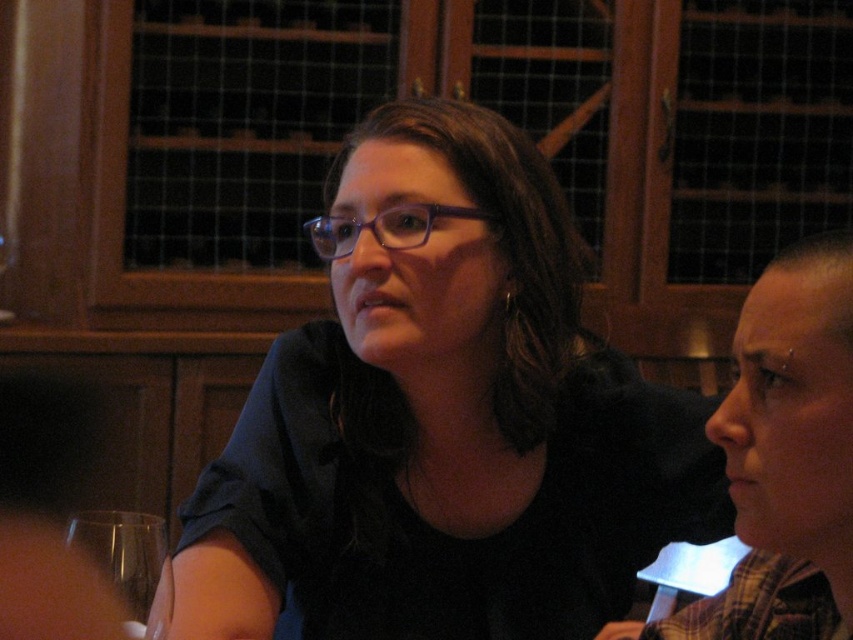
Question: Does matte black shirt at center lie in front of transparent glass at lower left?

Choices:
 (A) yes
 (B) no

Answer: (B)

Question: Which of the following is the farthest from the observer?

Choices:
 (A) matte black shirt at center
 (B) transparent glass at lower left

Answer: (A)

Question: Is matte black shirt at center below transparent glass at lower left?

Choices:
 (A) no
 (B) yes

Answer: (A)

Question: Is matte black shirt at center below transparent glass at lower left?

Choices:
 (A) no
 (B) yes

Answer: (A)